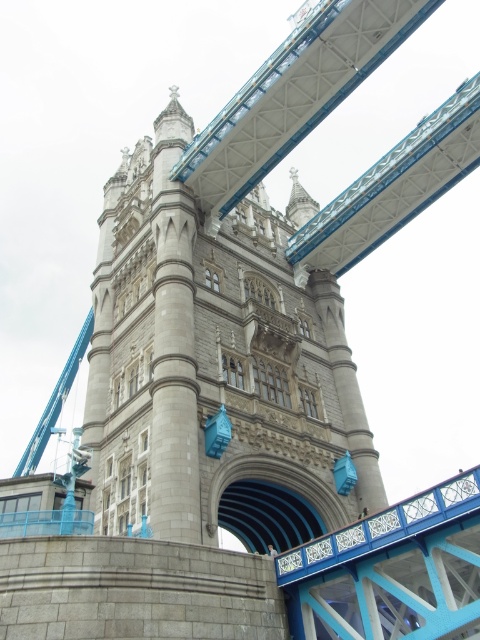
Is point (284, 246) positioned after point (450, 490)?

Yes.

Find the location of a particular element. This screenshot has height=640, width=480. stone tower at center is located at coordinates (216, 365).

What do you see at coordinates (216, 365) in the screenshot?
I see `stone tower at center` at bounding box center [216, 365].

Identify the location of stone tower at center. (216, 365).